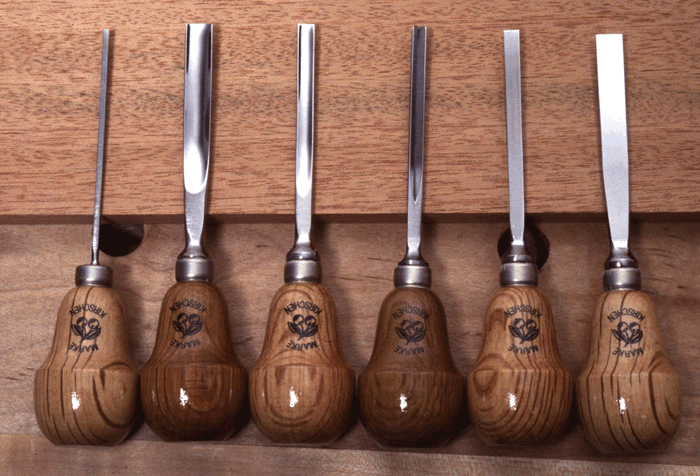
You are a GUI agent. You are given a task and a screenshot of the screen. Output one action in this format:
    pyautogui.click(x=<x>, y=<y>)
    Task: Click on the wooden handles
    Image resolution: width=700 pixels, height=476 pixels.
    Given the screenshot: What is the action you would take?
    pyautogui.click(x=87, y=394), pyautogui.click(x=220, y=380), pyautogui.click(x=304, y=383), pyautogui.click(x=398, y=393), pyautogui.click(x=498, y=398), pyautogui.click(x=623, y=400)